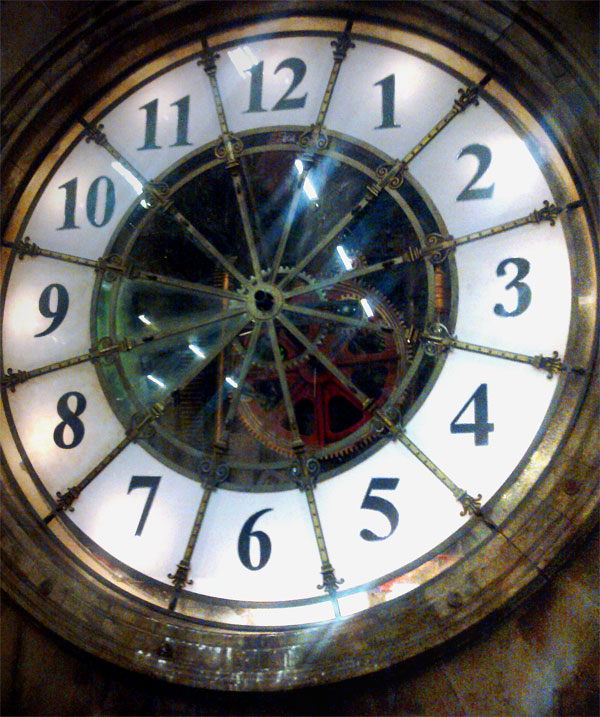
The height and width of the screenshot is (717, 600). What are the coordinates of `clock face` in the screenshot? It's located at (347, 107).